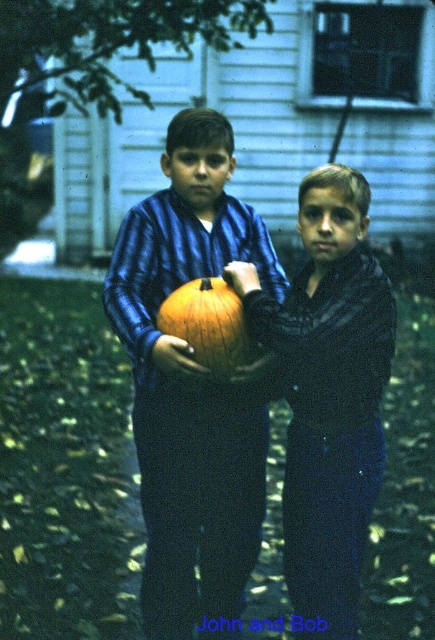
Is blue striped shirt at center in front of matte black jacket at center?

No, it is not.

Between point (170, 243) and point (324, 493), which one is positioned in front?

Point (324, 493) is in front.

Does point (197, 273) lie behind point (303, 483)?

Yes, point (197, 273) is farther from viewer.

In order to click on blue striped shirt at center in this screenshot , I will do `click(190, 387)`.

Who is positioned more to the left, matte black jacket at center or orange matte pumpkin at center?

Positioned to the left is orange matte pumpkin at center.

Which is above, matte black jacket at center or orange matte pumpkin at center?

orange matte pumpkin at center is higher up.

Is point (374, 333) positioned in front of point (191, 330)?

Yes.

Where is `matte black jacket at center`? matte black jacket at center is located at coordinates (328, 396).

Between point (129, 225) and point (177, 312), which one is positioned behind?

Positioned behind is point (129, 225).

Between blue striped shirt at center and orange matte pumpkin at center, which one appears on the right side from the viewer's perspective?

orange matte pumpkin at center

Find the location of a particular element. Image resolution: width=435 pixels, height=640 pixels. blue striped shirt at center is located at coordinates (190, 387).

This screenshot has height=640, width=435. Identify the location of blue striped shirt at center. (190, 387).